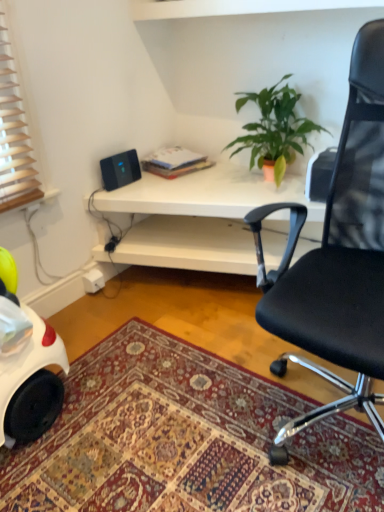
Question: Relative to black plastic speaker at upper left, is carpeted rug at lower center in front or behind?

Choices:
 (A) front
 (B) behind

Answer: (A)

Question: From their relative heights in the image, would you say carpeted rug at lower center is taller or shorter than black plastic speaker at upper left?

Choices:
 (A) short
 (B) tall

Answer: (A)

Question: Estimate the real-world distances between objects in this image. Which object is closer to the black plastic speaker at upper left?

Choices:
 (A) green matte plant at upper center
 (B) carpeted rug at lower center
 (C) white matte desk at center
 (D) black mesh office chair at upper right

Answer: (C)

Question: Estimate the real-world distances between objects in this image. Which object is closer to the black mesh office chair at upper right?

Choices:
 (A) black plastic speaker at upper left
 (B) green matte plant at upper center
 (C) carpeted rug at lower center
 (D) white matte desk at center

Answer: (C)